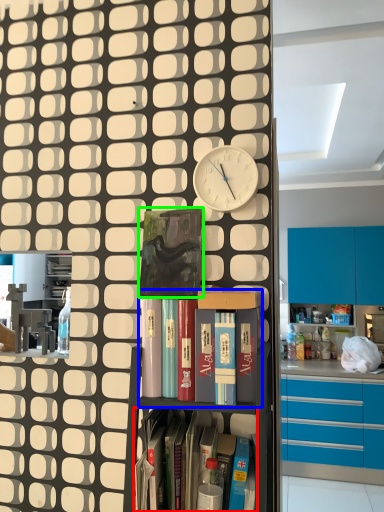
Question: Which object is the farthest from shelf (highlighted by a red box)? Choose among these: shelf (highlighted by a blue box) or paperback book (highlighted by a green box).

Choices:
 (A) shelf
 (B) paperback book

Answer: (B)